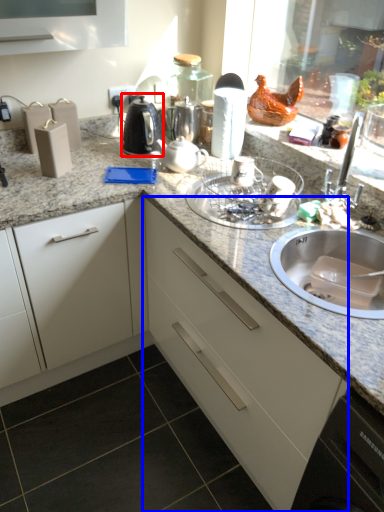
Question: Which of the following is the farthest to the observer, kitchen appliance (highlighted by a red box) or cabinetry (highlighted by a blue box)?

Choices:
 (A) kitchen appliance
 (B) cabinetry

Answer: (A)